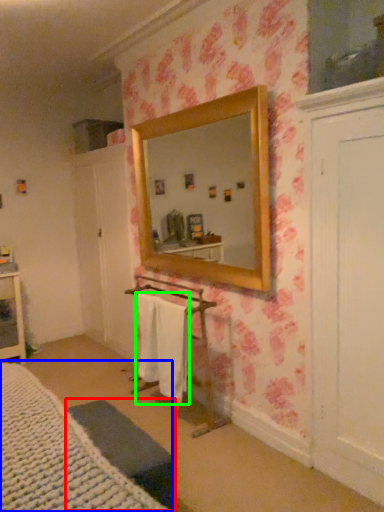
Question: Considering the real-world distances, which object is closest to furniture (highlighted by a red box)? bed (highlighted by a blue box) or bath towel (highlighted by a green box).

Choices:
 (A) bed
 (B) bath towel

Answer: (A)